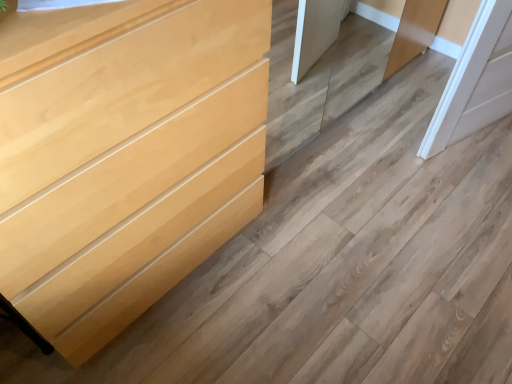
Find the location of a particular element. This screenshot has width=512, height=384. matte wood chest of drawers at left is located at coordinates (126, 158).

The height and width of the screenshot is (384, 512). Describe the element at coordinates (126, 158) in the screenshot. I see `matte wood chest of drawers at left` at that location.

The image size is (512, 384). Identify the location of matte wood chest of drawers at left. (126, 158).